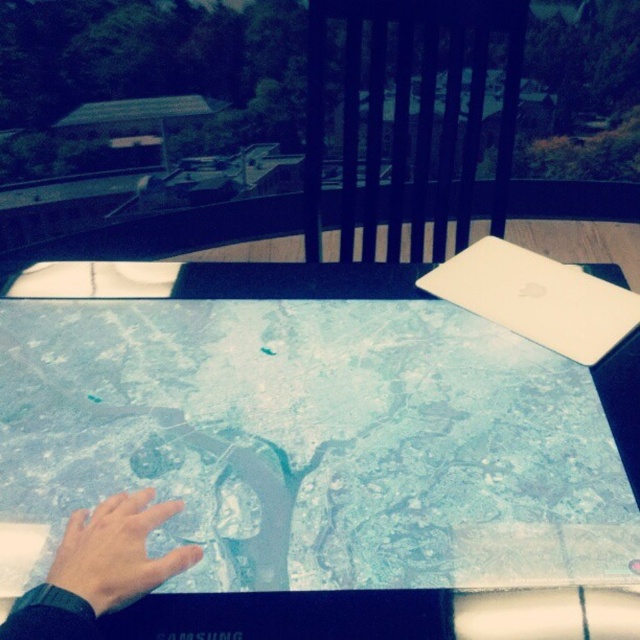
You are organizing a small event and need to place a decorative plate that is 12 inches wide on the table. The plate must be placed between the white matte laptop at upper right and the matte skin hand at lower left. Given their current positions and sizes, will the plate fit horizontally between them?

The white matte laptop at upper right is wider than the matte skin hand at lower left. Since the plate is 12 inches wide, we need to know the exact width of the space between them. However, the description only states the laptop is wider than the hand but doesn not provide specific measurements. Without knowing the actual width of the space, we cannot definitively say if the plate will fit.

You are a photographer trying to capture a closeup of the map on the table. You notice two hands, the smooth skin hand at lower left and the matte skin hand at lower left, resting on the map. Which hand should you move to get a clearer view of the map?

The smooth skin hand at lower left should be moved because it is wider than the matte skin hand at lower left, so removing it would reveal more of the map.